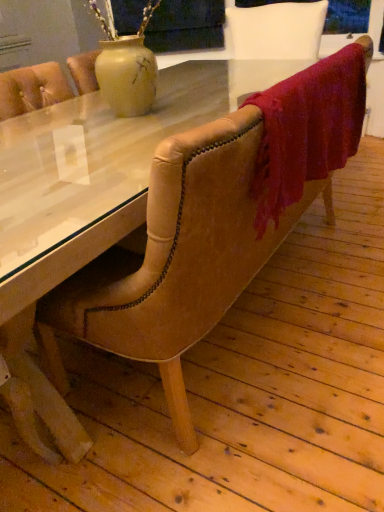
In order to face transparent glass table at center, should I rotate leftwards or rightwards?

To face it directly, rotate right by 6.153 degrees.

Describe the element at coordinates (104, 152) in the screenshot. I see `transparent glass table at center` at that location.

Where is `transparent glass table at center`? This screenshot has height=512, width=384. transparent glass table at center is located at coordinates (104, 152).

In the scene shown: What is the approximate height of transparent glass table at center?

The height of transparent glass table at center is 36.90 inches.

Image resolution: width=384 pixels, height=512 pixels. What are the coordinates of `velvet red blanket at upper right` in the screenshot? It's located at (307, 130).

What do you see at coordinates (307, 130) in the screenshot?
I see `velvet red blanket at upper right` at bounding box center [307, 130].

Locate an element on the screen. This screenshot has width=384, height=512. transparent glass table at center is located at coordinates (104, 152).

Would you say velvet red blanket at upper right is to the left or to the right of transparent glass table at center in the picture?

velvet red blanket at upper right is positioned on transparent glass table at center's right side.

Is velvet red blanket at upper right in front of transparent glass table at center?

No, the depth of velvet red blanket at upper right is greater than that of transparent glass table at center.

Between point (339, 146) and point (84, 127), which one is positioned in front?

Positioned in front is point (339, 146).

From the image's perspective, is velvet red blanket at upper right on top of transparent glass table at center?

Correct, velvet red blanket at upper right appears higher than transparent glass table at center in the image.

From a real-world perspective, is velvet red blanket at upper right positioned under transparent glass table at center based on gravity?

Incorrect, from a real-world perspective, velvet red blanket at upper right is higher than transparent glass table at center.

Looking at their sizes, would you say velvet red blanket at upper right is wider or thinner than transparent glass table at center?

velvet red blanket at upper right is thinner than transparent glass table at center.

Is velvet red blanket at upper right taller or shorter than transparent glass table at center?

velvet red blanket at upper right is shorter than transparent glass table at center.

Can you confirm if velvet red blanket at upper right is smaller than transparent glass table at center?

Correct, velvet red blanket at upper right occupies less space than transparent glass table at center.

Is velvet red blanket at upper right inside the boundaries of transparent glass table at center, or outside?

velvet red blanket at upper right is spatially situated outside transparent glass table at center.

Consider the image. Is velvet red blanket at upper right touching transparent glass table at center?

No, velvet red blanket at upper right is not in contact with transparent glass table at center.

Is transparent glass table at center at the back of velvet red blanket at upper right?

No.

Locate an element on the screen. glass table below the velvet red blanket at upper right (from the image's perspective) is located at coordinates (104, 152).

Does transparent glass table at center appear on the left side of velvet red blanket at upper right?

Yes, transparent glass table at center is to the left of velvet red blanket at upper right.

Which is behind, transparent glass table at center or velvet red blanket at upper right?

velvet red blanket at upper right is further away from the camera.

Between point (236, 96) and point (296, 92), which one is positioned behind?

Positioned behind is point (236, 96).

From the image's perspective, which one is positioned higher, transparent glass table at center or velvet red blanket at upper right?

velvet red blanket at upper right appears higher in the image.

From a real-world perspective, which object stands above the other?

velvet red blanket at upper right, from a real-world perspective.

From the picture: Is transparent glass table at center wider than velvet red blanket at upper right?

Yes.

Considering the sizes of transparent glass table at center and velvet red blanket at upper right in the image, is transparent glass table at center taller or shorter than velvet red blanket at upper right?

In the image, transparent glass table at center appears to be taller than velvet red blanket at upper right.

From the picture: Based on their sizes in the image, would you say transparent glass table at center is bigger or smaller than velvet red blanket at upper right?

transparent glass table at center is bigger than velvet red blanket at upper right.

Would you say transparent glass table at center is inside or outside velvet red blanket at upper right?

transparent glass table at center is located beyond the bounds of velvet red blanket at upper right.

Is transparent glass table at center touching velvet red blanket at upper right?

transparent glass table at center is not next to velvet red blanket at upper right, and they're not touching.

Is transparent glass table at center aimed at velvet red blanket at upper right?

No, transparent glass table at center is not oriented towards velvet red blanket at upper right.

Find the location of `glass table lying in front of the velvet red blanket at upper right`. glass table lying in front of the velvet red blanket at upper right is located at coordinates (104, 152).

Where is `blanket lying on the right of transparent glass table at center`? Image resolution: width=384 pixels, height=512 pixels. blanket lying on the right of transparent glass table at center is located at coordinates (307, 130).

Find the location of a particular element. This screenshot has height=512, width=384. blanket behind the transparent glass table at center is located at coordinates (307, 130).